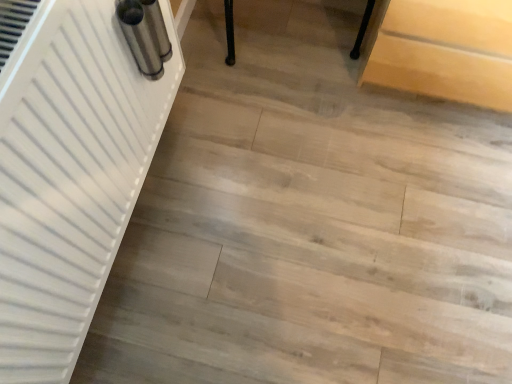
The width and height of the screenshot is (512, 384). Identify the location of white matte radiator at left. (68, 171).

What do you see at coordinates (68, 171) in the screenshot?
I see `white matte radiator at left` at bounding box center [68, 171].

Locate an element on the screen. white matte radiator at left is located at coordinates (68, 171).